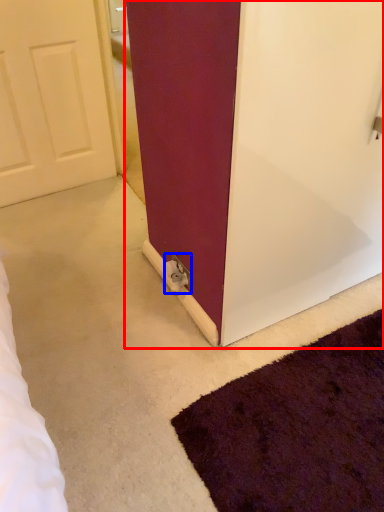
Question: Which object appears closest to the camera in this image, door (highlighted by a red box) or electric outlet (highlighted by a blue box)?

Choices:
 (A) door
 (B) electric outlet

Answer: (A)